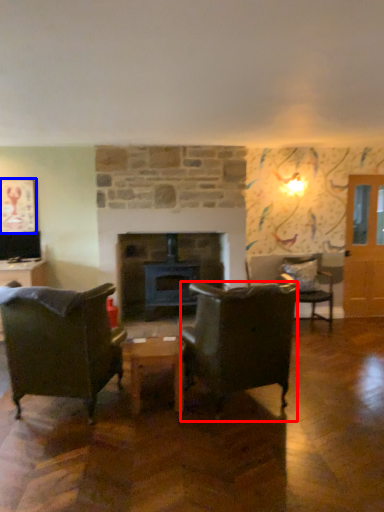
Question: Which object is further to the camera taking this photo, chair (highlighted by a red box) or picture frame (highlighted by a blue box)?

Choices:
 (A) chair
 (B) picture frame

Answer: (B)